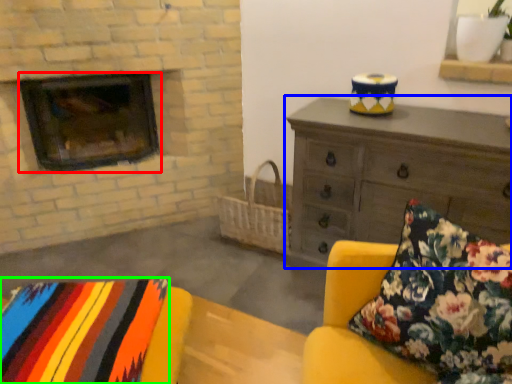
Question: Which is nearer to the wood burning stove (highlighted by a red box)? chest of drawers (highlighted by a blue box) or blanket (highlighted by a green box).

Choices:
 (A) chest of drawers
 (B) blanket

Answer: (A)